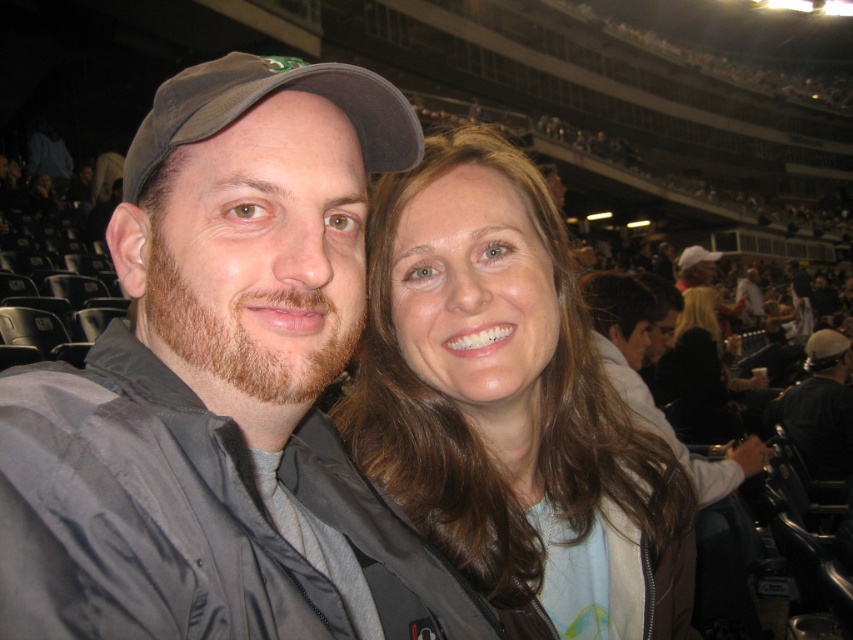
Does matte gray jacket at center have a lesser width compared to black leather jacket at lower right?

Correct, matte gray jacket at center's width is less than black leather jacket at lower right's.

Who is positioned more to the right, matte gray jacket at center or black leather jacket at lower right?

black leather jacket at lower right

Is point (9, 611) closer to camera compared to point (811, 333)?

That is True.

Find the location of `matte gray jacket at center`. matte gray jacket at center is located at coordinates (222, 362).

Which is above, matte gray jacket at center or smooth brown hair at center?

matte gray jacket at center is above.

Can you confirm if matte gray jacket at center is positioned to the right of smooth brown hair at center?

Incorrect, matte gray jacket at center is not on the right side of smooth brown hair at center.

This screenshot has width=853, height=640. Describe the element at coordinates (222, 362) in the screenshot. I see `matte gray jacket at center` at that location.

Identify the location of matte gray jacket at center. This screenshot has width=853, height=640. (222, 362).

Is point (509, 586) farther from viewer compared to point (844, 396)?

That is False.

Can you confirm if smooth brown hair at center is wider than black leather jacket at lower right?

Yes.

Is point (440, 273) closer to viewer compared to point (815, 390)?

Yes, point (440, 273) is closer to viewer.

The height and width of the screenshot is (640, 853). What are the coordinates of `smooth brown hair at center` in the screenshot? It's located at (508, 401).